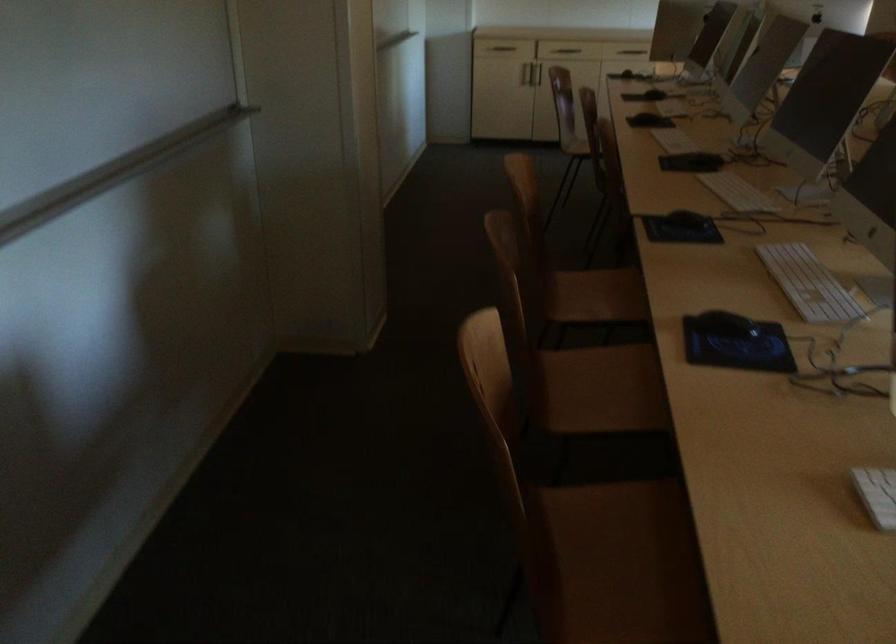
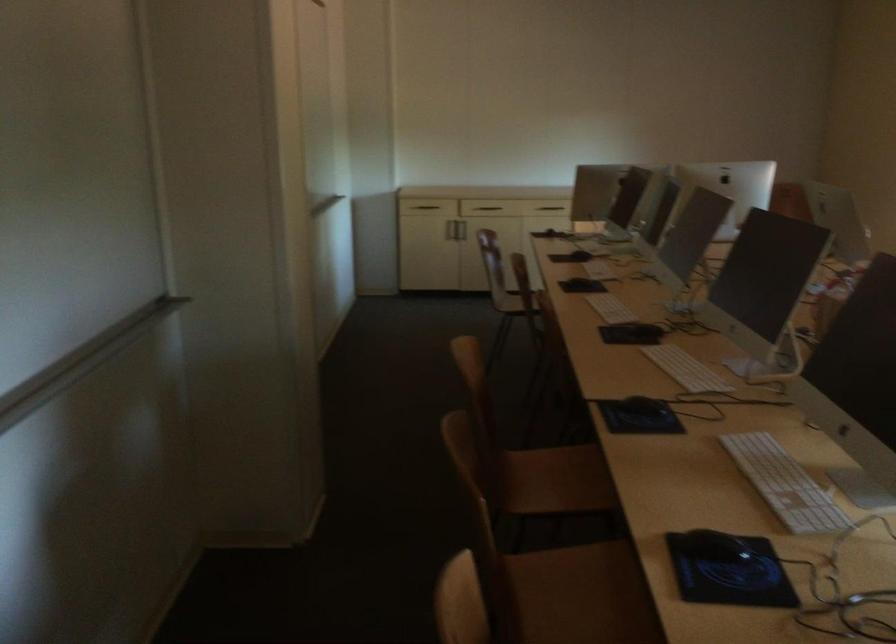
Locate, in the second image, the point that corresponds to pixel 543 73 in the first image.

(466, 230)